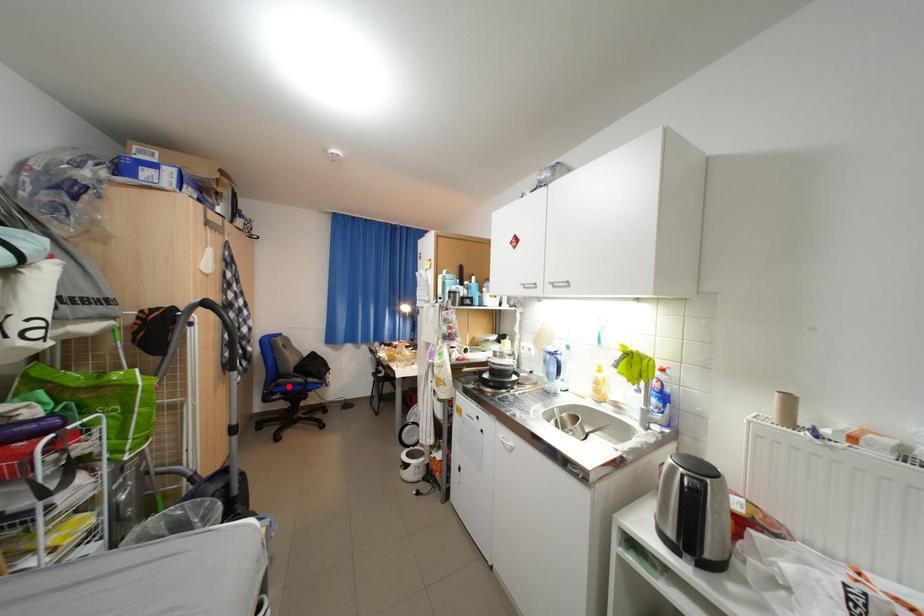
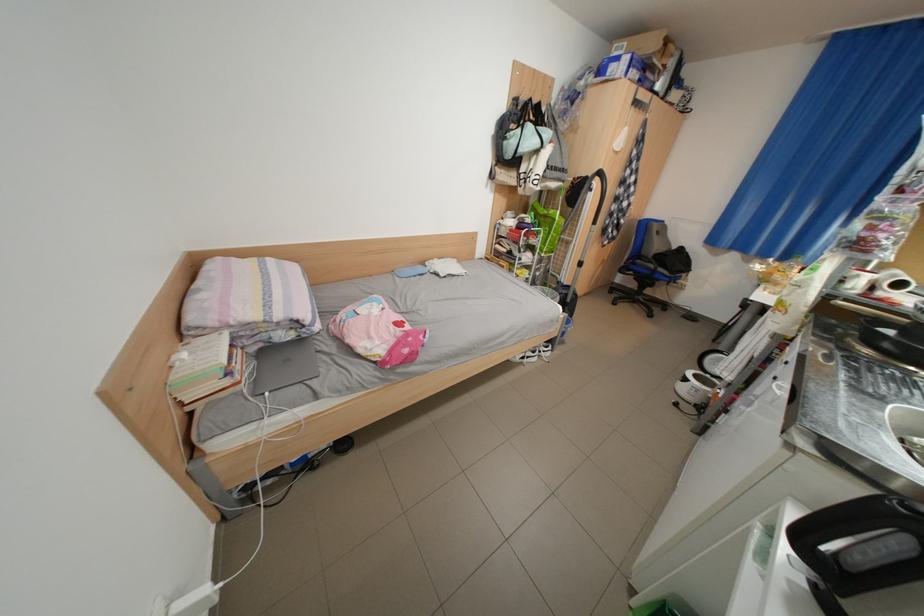
The point at the highlighted location is marked in the first image. Where is the corresponding point in the second image?

(646, 265)